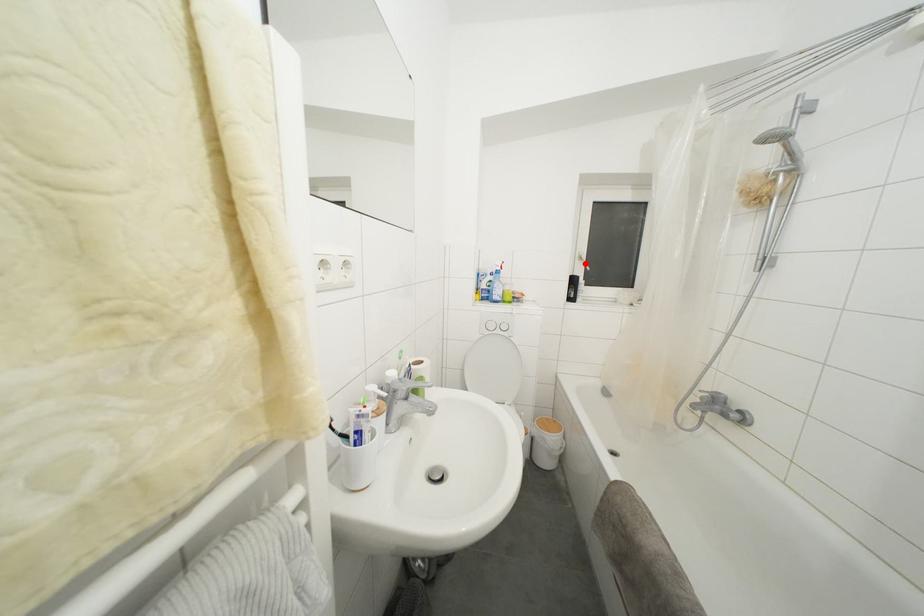
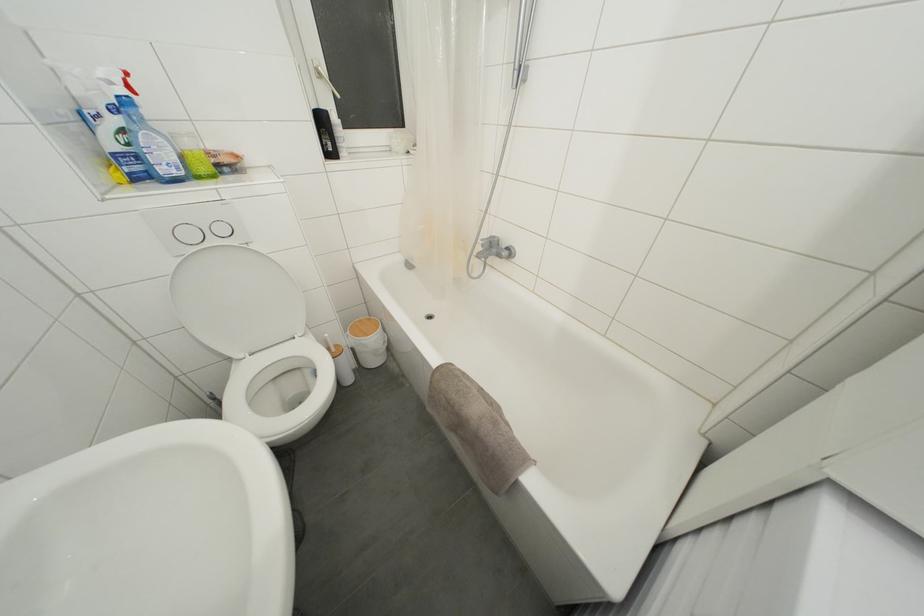
The point at the highlighted location is marked in the first image. Where is the corresponding point in the second image?

(323, 79)